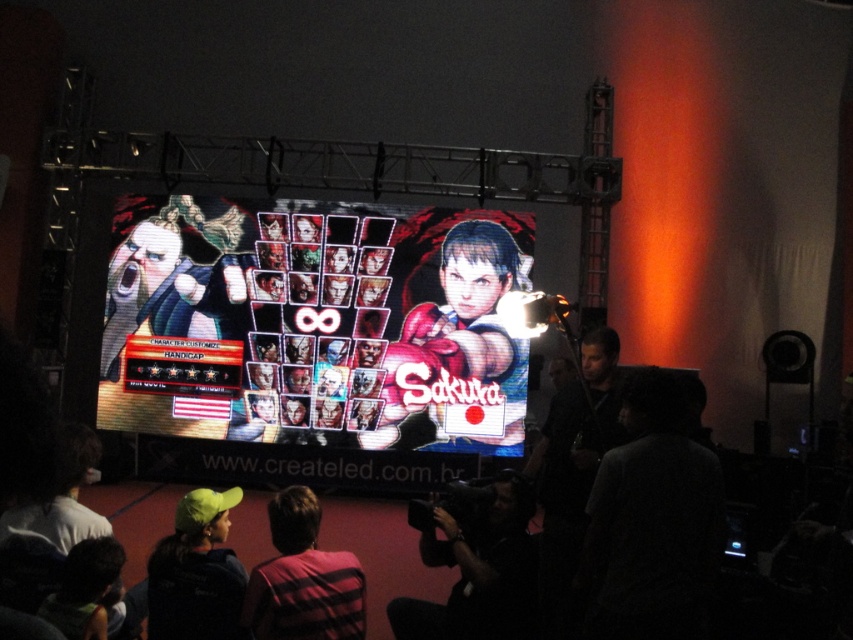
Question: Which point appears farthest from the camera in this image?

Choices:
 (A) (589, 582)
 (B) (415, 611)

Answer: (B)

Question: Which point is farther from the camera taking this photo?

Choices:
 (A) (236, 588)
 (B) (268, 330)

Answer: (B)

Question: Does dark gray fabric at lower right appear under green fabric cap at lower left?

Choices:
 (A) no
 (B) yes

Answer: (A)

Question: Does plaid shirt at lower center have a larger size compared to green fabric cap at lower left?

Choices:
 (A) yes
 (B) no

Answer: (B)

Question: Is pixelated digital display at center further to camera compared to dark gray fabric camera at lower center?

Choices:
 (A) yes
 (B) no

Answer: (A)

Question: Which point is closer to the camera taking this photo?

Choices:
 (A) (418, 630)
 (B) (630, 513)

Answer: (B)